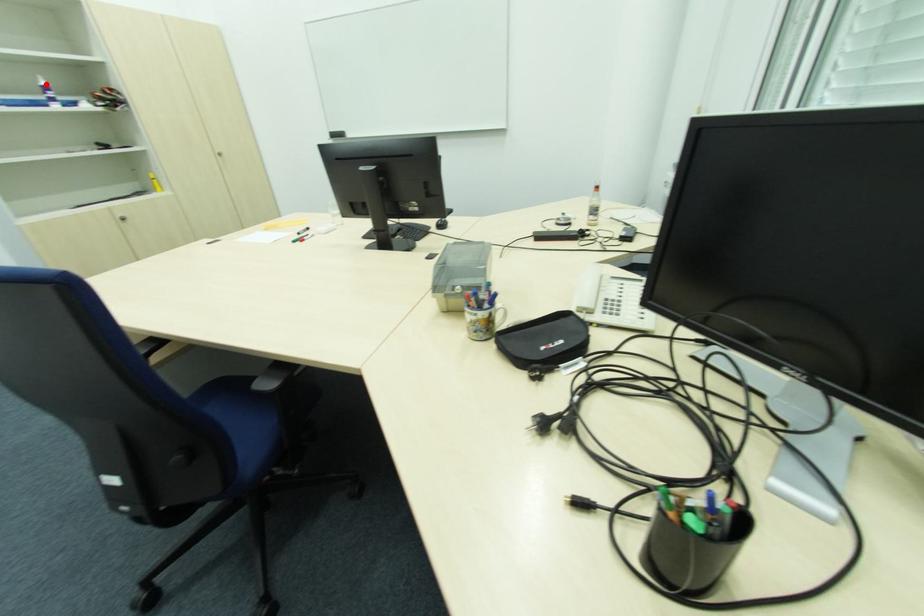
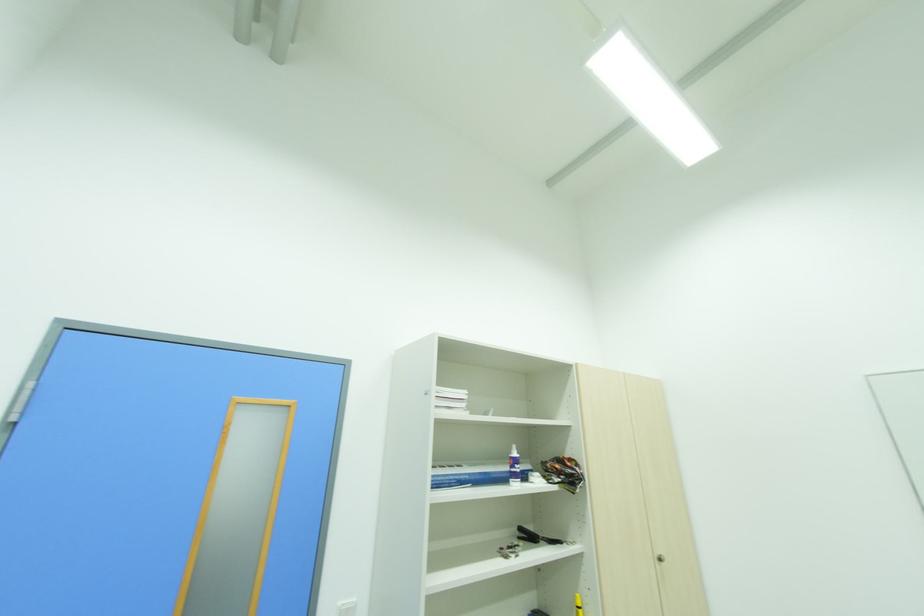
Question: I am providing you with two images of the same scene from different viewpoints. Given a red point in image1, look at the same physical point in image2. Is it:

Choices:
 (A) Closer to the viewpoint
 (B) Farther from the viewpoint

Answer: (A)